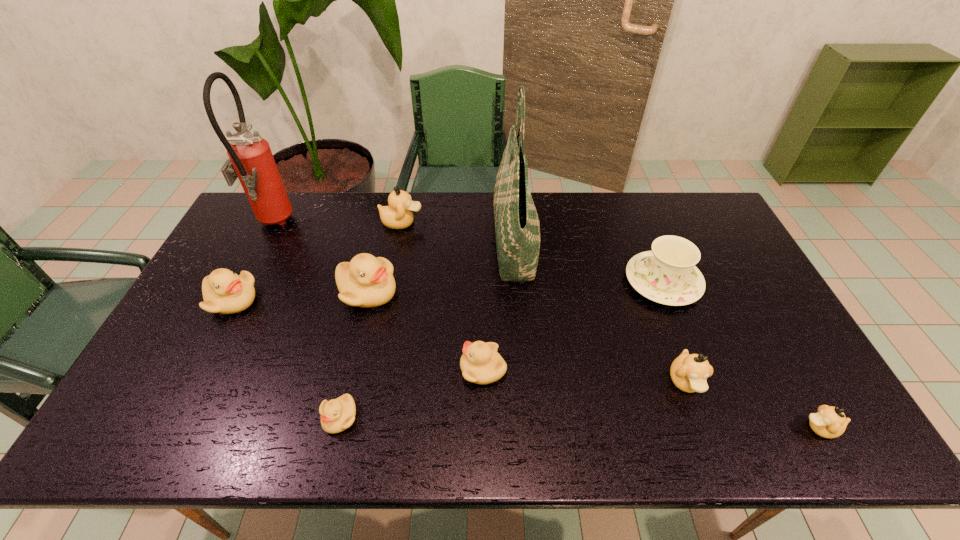
The image size is (960, 540). Identify the location of vacant point that satisfies the following two spatial constraints: 1. at the nozzle of the fire extinguisher; 2. on the left side of the tote bag. [x=262, y=242].

I want to click on free space that satisfies the following two spatial constraints: 1. on the front side of the tote bag; 2. on the beak of the third biggest yellow duckling, so click(524, 369).